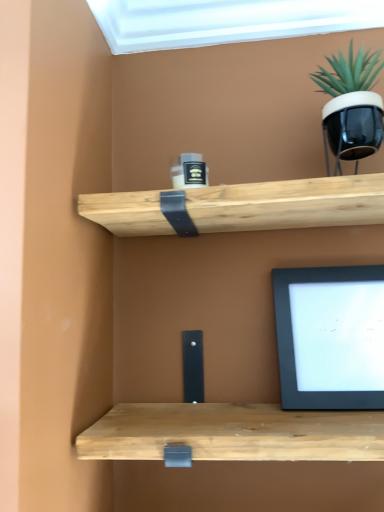
Question: Does black glossy pot at upper right appear on the right side of black matte computer monitor at lower right?

Choices:
 (A) no
 (B) yes

Answer: (B)

Question: Can you confirm if black glossy pot at upper right is taller than black matte computer monitor at lower right?

Choices:
 (A) no
 (B) yes

Answer: (A)

Question: Is black glossy pot at upper right bigger than black matte computer monitor at lower right?

Choices:
 (A) yes
 (B) no

Answer: (A)

Question: Is black glossy pot at upper right with black matte computer monitor at lower right?

Choices:
 (A) no
 (B) yes

Answer: (A)

Question: Is the depth of black glossy pot at upper right greater than that of black matte computer monitor at lower right?

Choices:
 (A) yes
 (B) no

Answer: (B)

Question: Is black glossy pot at upper right wider than black matte computer monitor at lower right?

Choices:
 (A) no
 (B) yes

Answer: (B)

Question: Is black matte computer monitor at lower right aimed at black glossy pot at upper right?

Choices:
 (A) yes
 (B) no

Answer: (B)

Question: Is black matte computer monitor at lower right completely or partially outside of black glossy pot at upper right?

Choices:
 (A) yes
 (B) no

Answer: (A)

Question: Considering the relative sizes of black matte computer monitor at lower right and black glossy pot at upper right in the image provided, is black matte computer monitor at lower right thinner than black glossy pot at upper right?

Choices:
 (A) yes
 (B) no

Answer: (A)

Question: Is black glossy pot at upper right a part of black matte computer monitor at lower right?

Choices:
 (A) no
 (B) yes

Answer: (A)

Question: Is black matte computer monitor at lower right oriented away from black glossy pot at upper right?

Choices:
 (A) yes
 (B) no

Answer: (B)

Question: From the image's perspective, does black matte computer monitor at lower right appear higher than black glossy pot at upper right?

Choices:
 (A) no
 (B) yes

Answer: (A)

Question: Based on their positions, is black glossy pot at upper right located to the left or right of black matte computer monitor at lower right?

Choices:
 (A) right
 (B) left

Answer: (A)